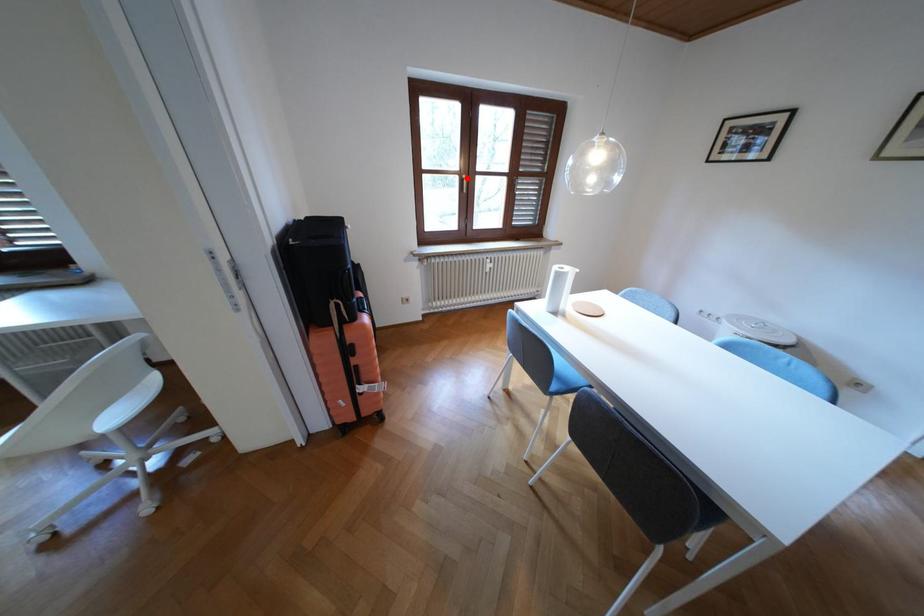
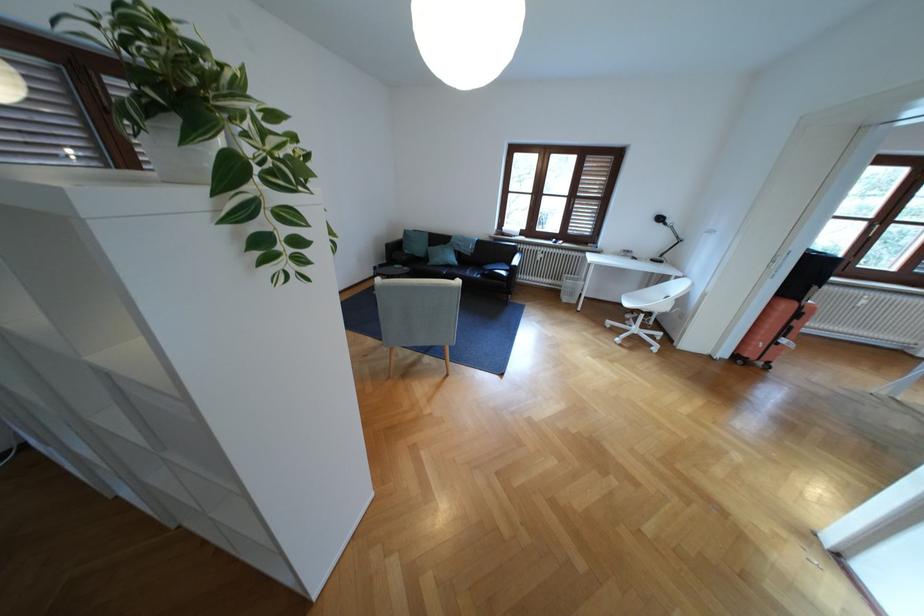
Locate, in the second image, the point that corresponds to the highlighted location in the first image.

(877, 224)